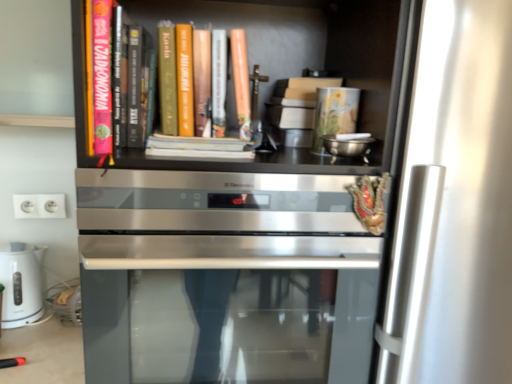
Question: Considering the positions of matte orange book at center, the 1th book from the right, and white glossy electric kettle at lower left in the image, is matte orange book at center, the 1th book from the right, wider or thinner than white glossy electric kettle at lower left?

Choices:
 (A) thin
 (B) wide

Answer: (A)

Question: Visually, is matte orange book at center, positioned as the second book in left-to-right order, positioned to the left or to the right of white glossy electric kettle at lower left?

Choices:
 (A) left
 (B) right

Answer: (B)

Question: Based on their relative distances, which object is nearer to the white glossy electric kettle at lower left?

Choices:
 (A) pink matte book at upper left, which appears as the 2th book when viewed from the right
 (B) matte orange book at center, the 1th book from the right
 (C) white plastic electrical outlet at lower left
 (D) satin silver oven at center

Answer: (C)

Question: Estimate the real-world distances between objects in this image. Which object is closer to the pink matte book at upper left, the 1th book viewed from the left?

Choices:
 (A) matte orange book at center, the 1th book from the right
 (B) satin silver oven at center
 (C) white plastic electrical outlet at lower left
 (D) white glossy electric kettle at lower left

Answer: (A)